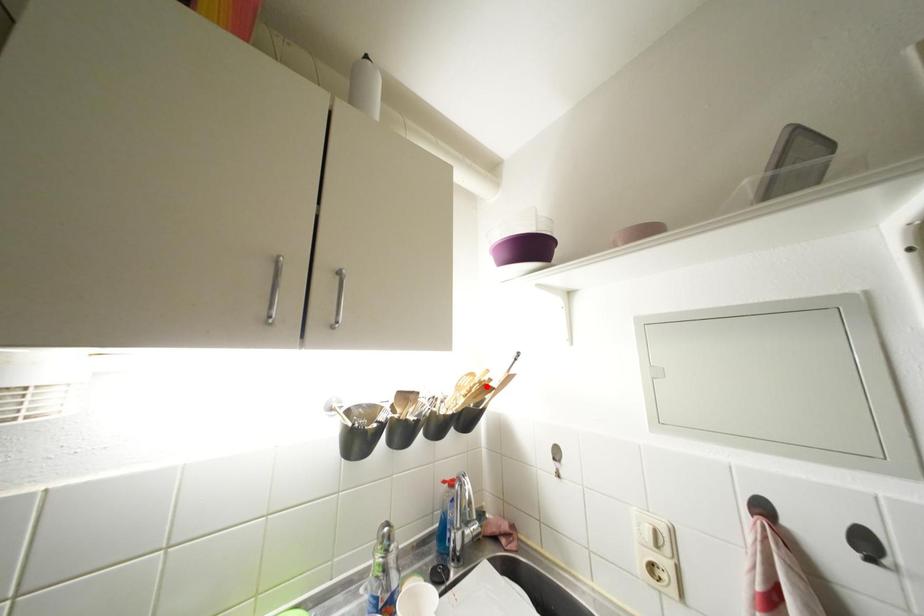
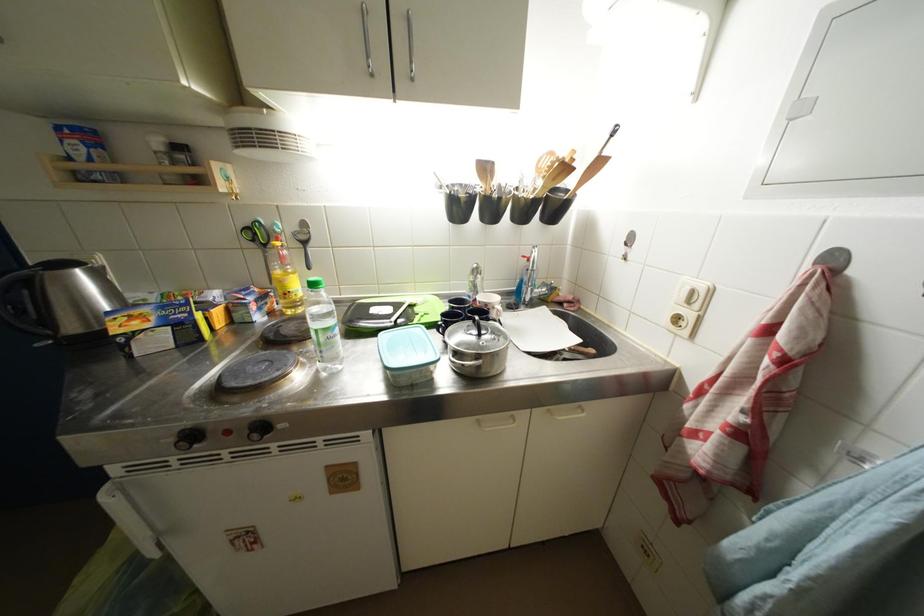
Find the pixel in the second image that matches the highlighted location in the first image.

(565, 164)